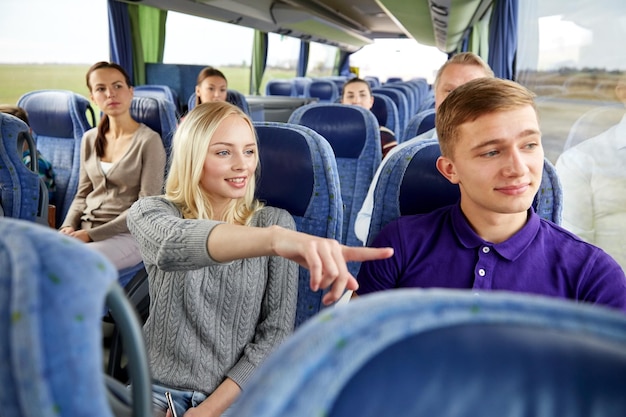
What are the coordinates of `windows` in the screenshot? It's located at (52, 54), (197, 29), (279, 55), (320, 55), (387, 52), (489, 37), (566, 56).